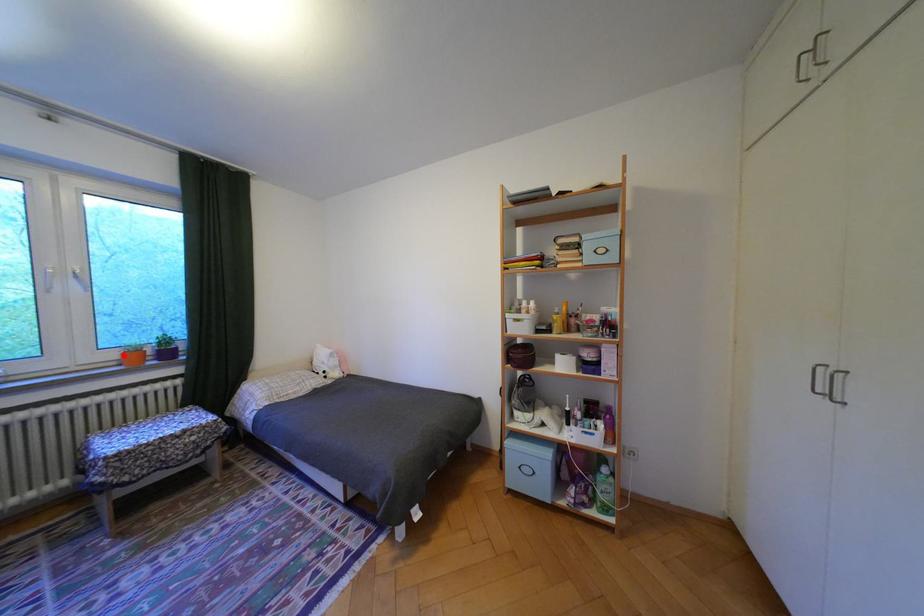
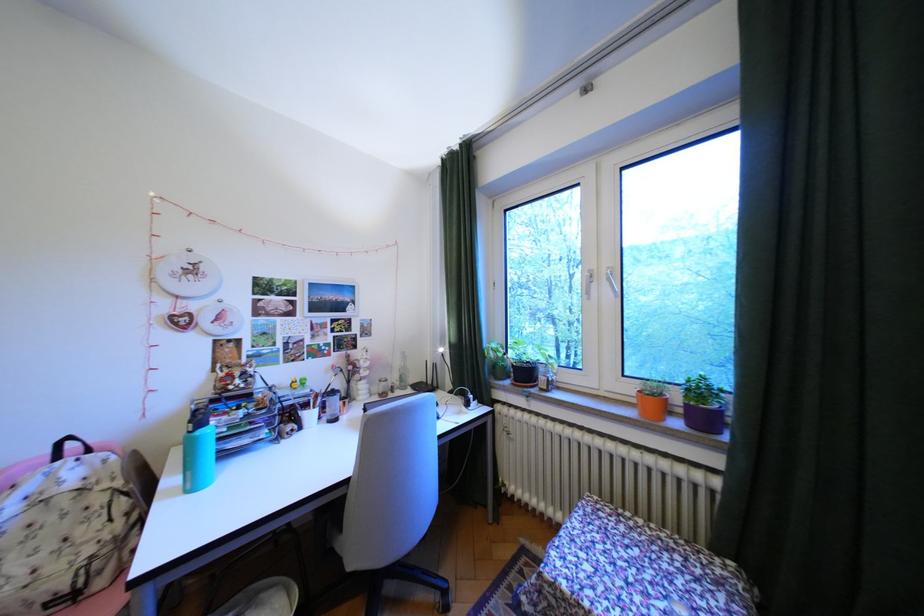
The point at the highlighted location is marked in the first image. Where is the corresponding point in the second image?

(641, 390)